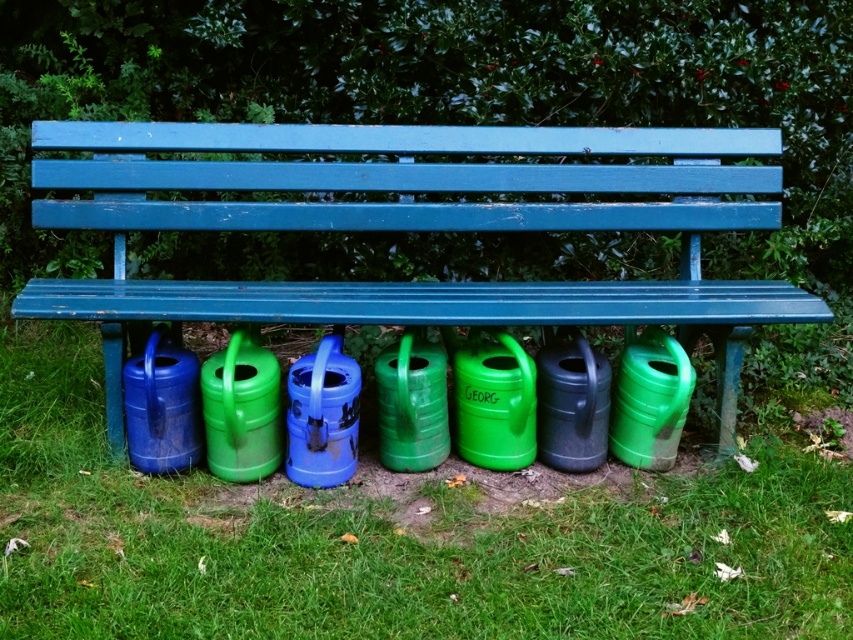
Looking at this image, you are a gardener who needs to determine if the green matte watering cans at lower center can fit under the matte blue bench at center. Based on their sizes, will they fit?

The green matte watering cans at lower center is larger in size than the matte blue bench at center, so they will not fit under the bench.

In the scene shown: You are trying to determine if the green matte watering cans at lower center can fit under the matte blue bench at center. Based on their heights, can they be placed there without exceeding the bench height?

The green matte watering cans at lower center are shorter than the matte blue bench at center, so they can fit under the bench without exceeding its height.